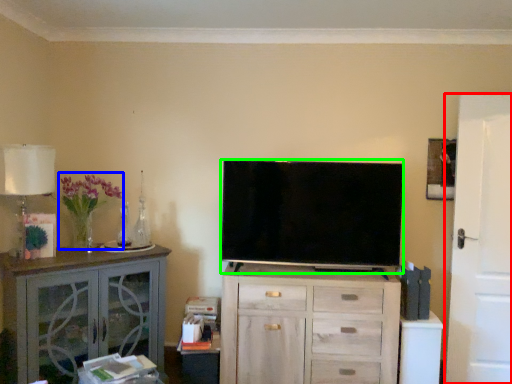
Question: Which object is the closest to the door (highlighted by a red box)? Choose among these: flower (highlighted by a blue box) or television (highlighted by a green box).

Choices:
 (A) flower
 (B) television

Answer: (B)